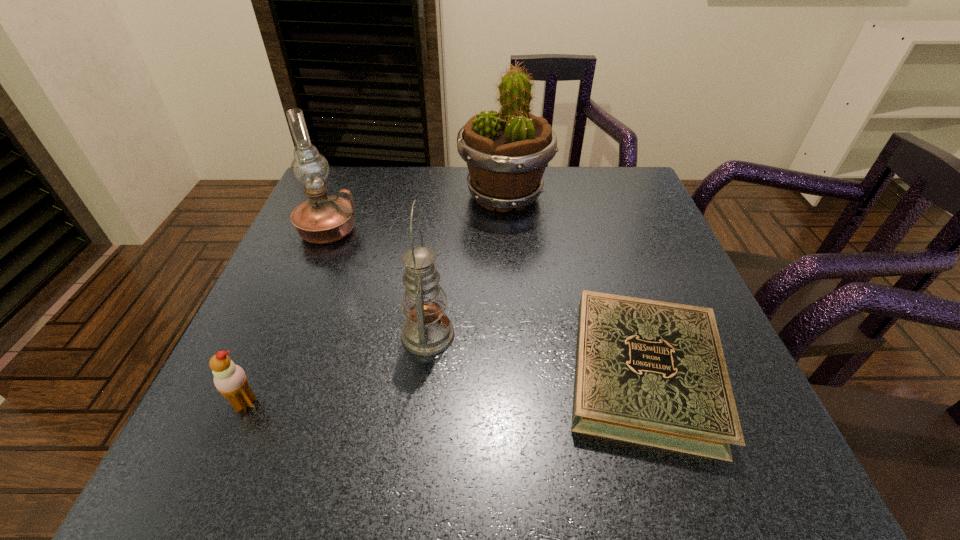
The width and height of the screenshot is (960, 540). I want to click on vacant area between the flowerpot and the left oil lamp, so click(417, 213).

Image resolution: width=960 pixels, height=540 pixels. In order to click on empty space between the right oil lamp and the shortest object in this screenshot , I will do pyautogui.click(x=537, y=354).

Where is `vacant area that lies between the farther oil lamp and the second shortest object`? vacant area that lies between the farther oil lamp and the second shortest object is located at coordinates (287, 318).

Choose which object is the fourth nearest neighbor to the farther oil lamp. Please provide its 2D coordinates. Your answer should be formatted as a tuple, i.e. [(x, y)], where the tuple contains the x and y coordinates of a point satisfying the conditions above.

[(649, 372)]

Identify which object is the fourth nearest to the nearer oil lamp. Please provide its 2D coordinates. Your answer should be formatted as a tuple, i.e. [(x, y)], where the tuple contains the x and y coordinates of a point satisfying the conditions above.

[(506, 152)]

At what (x,y) coordinates should I click in order to perform the action: click on free space that satisfies the following two spatial constraints: 1. on the front side of the right oil lamp; 2. on the left side of the hardback book. Please return your answer as a coordinate pair (x, y). This screenshot has width=960, height=540. Looking at the image, I should click on (424, 373).